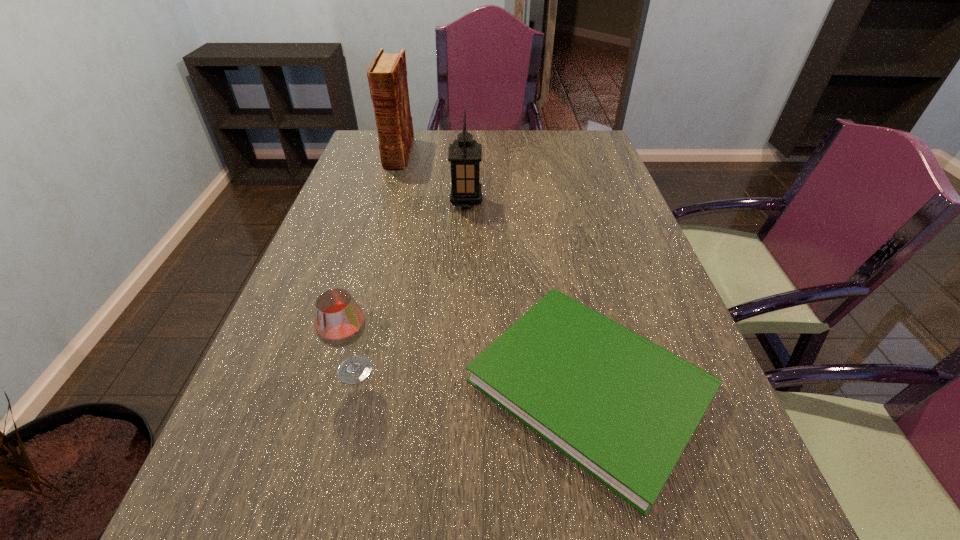
At what (x,y) coordinates should I click in order to perform the action: click on the farthest object. Please return your answer as a coordinate pair (x, y). Image resolution: width=960 pixels, height=540 pixels. Looking at the image, I should click on (387, 75).

Where is `lantern`? The height and width of the screenshot is (540, 960). lantern is located at coordinates [465, 154].

The height and width of the screenshot is (540, 960). What are the coordinates of `the second shortest object` in the screenshot? It's located at (339, 322).

The height and width of the screenshot is (540, 960). In order to click on paperback book in this screenshot , I will do `click(621, 407)`.

The width and height of the screenshot is (960, 540). What are the coordinates of `vacant space located 0.060m on the spine side of the hardback book` in the screenshot? It's located at (391, 180).

Where is `vacant space situated 0.370m on the back of the third nearest object`? The image size is (960, 540). vacant space situated 0.370m on the back of the third nearest object is located at coordinates (469, 140).

Where is `free location located on the front of the wineglass`? This screenshot has height=540, width=960. free location located on the front of the wineglass is located at coordinates (335, 445).

At what (x,y) coordinates should I click in order to perform the action: click on free space located 0.340m on the back of the shortest object. Please return your answer as a coordinate pair (x, y). This screenshot has width=960, height=540. Looking at the image, I should click on (553, 215).

This screenshot has width=960, height=540. Find the location of `object at the far edge`. object at the far edge is located at coordinates (387, 75).

Find the location of a particular element. Image resolution: width=960 pixels, height=540 pixels. hardback book present at the left edge is located at coordinates (387, 75).